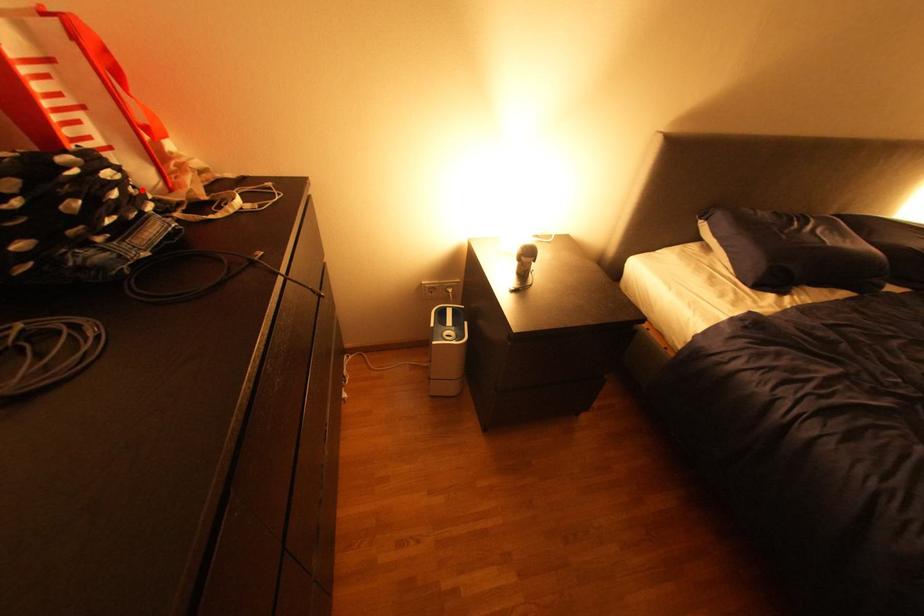
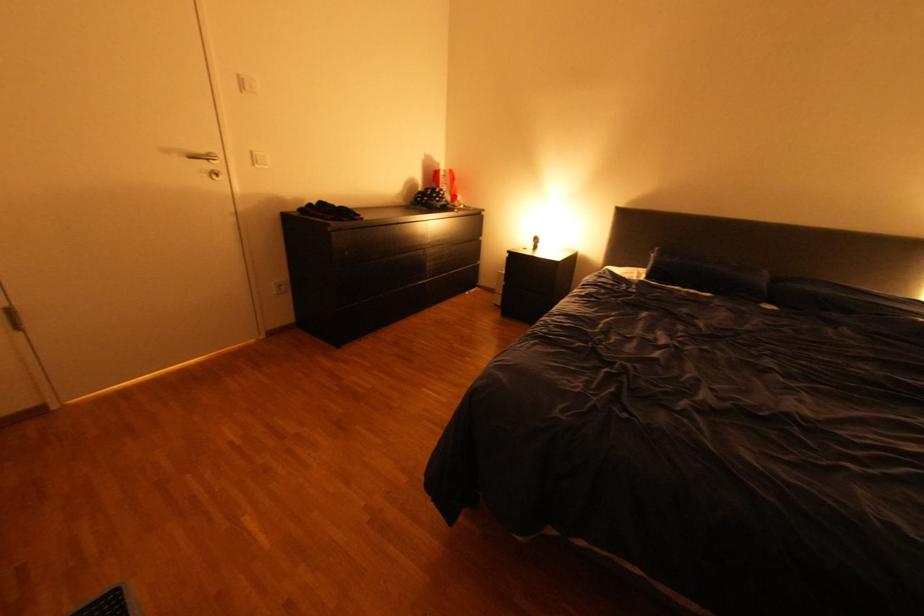
I am providing you with two images of the same scene from different viewpoints. A red point is marked on the first image and another point is marked on the second image. Are the points marked in image1 and image2 representing the same 3D position?

Yes